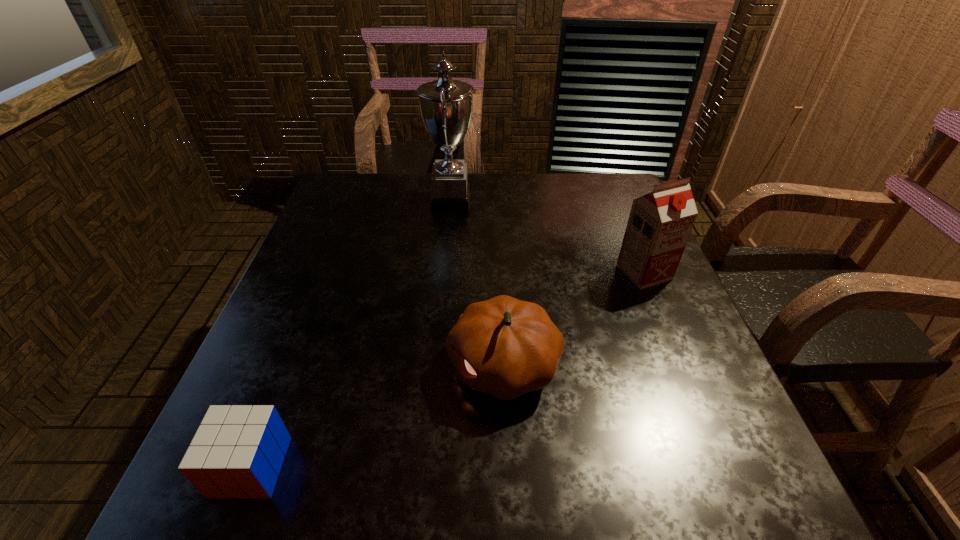
In the image, there is a desktop. In order to click on vacant space at the left edge in this screenshot , I will do `click(335, 308)`.

Locate an element on the screen. free region at the right edge of the desktop is located at coordinates (665, 396).

Where is `vacant space at the far left corner of the desktop`? vacant space at the far left corner of the desktop is located at coordinates (347, 176).

Locate an element on the screen. free location at the far right corner of the desktop is located at coordinates (593, 177).

The width and height of the screenshot is (960, 540). What are the coordinates of `free space between the cube and the trophy cup` in the screenshot? It's located at (351, 333).

Identify the location of unoccupied position between the tallest object and the second nearest object. (477, 282).

Locate an element on the screen. vacant area between the nearest object and the trophy cup is located at coordinates (351, 333).

The height and width of the screenshot is (540, 960). Find the location of `free space between the rightmost object and the second nearest object`. free space between the rightmost object and the second nearest object is located at coordinates (574, 319).

Find the location of a particular element. The width and height of the screenshot is (960, 540). free space that is in between the leftmost object and the farthest object is located at coordinates (351, 333).

Find the location of a particular element. The height and width of the screenshot is (540, 960). empty space that is in between the third tallest object and the leftmost object is located at coordinates (377, 416).